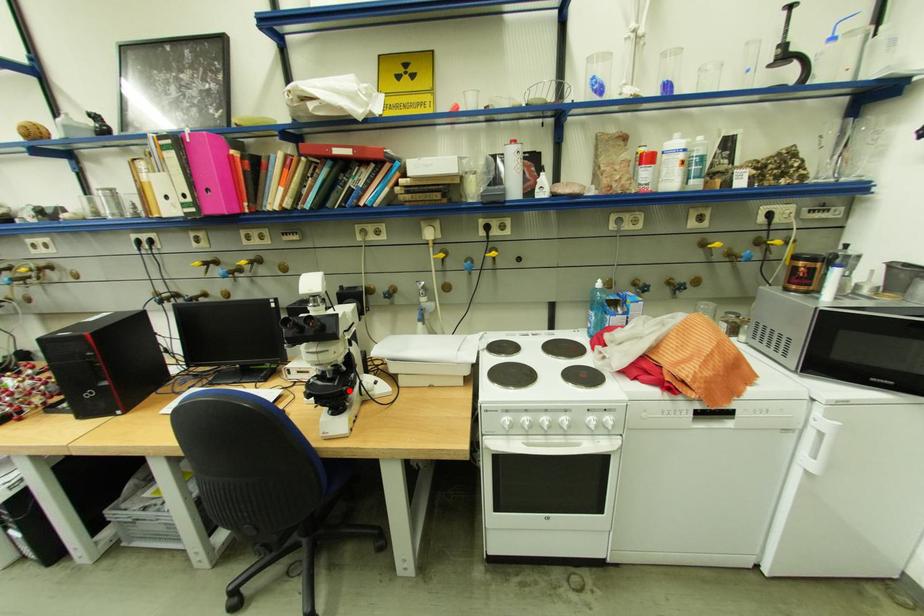
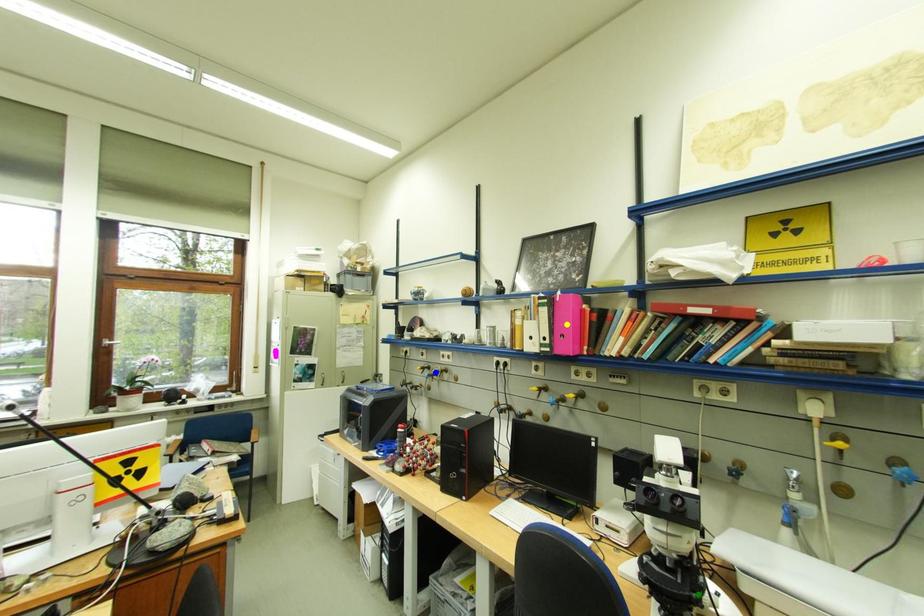
Question: I am providing you with two images of the same scene from different viewpoints. A red point is marked on the first image. You are given multiple points on the second image. Which mark in image 2 goes with the point in image 1?

Choices:
 (A) yellow point
 (B) blue point
 (C) green point

Answer: (C)